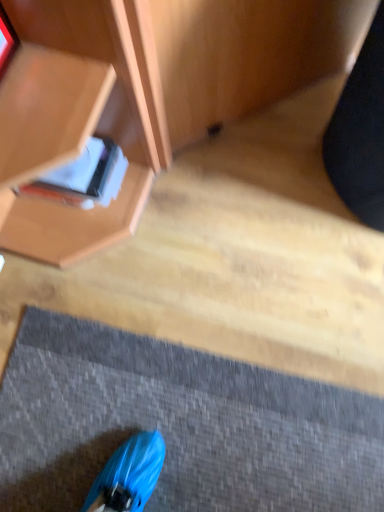
Image resolution: width=384 pixels, height=512 pixels. What do you see at coordinates (197, 58) in the screenshot? I see `matte wood side table at upper left` at bounding box center [197, 58].

Where is `matte wood side table at upper left`? This screenshot has height=512, width=384. matte wood side table at upper left is located at coordinates (197, 58).

Locate an element on the screen. Image resolution: width=384 pixels, height=512 pixels. matte wood side table at upper left is located at coordinates (197, 58).